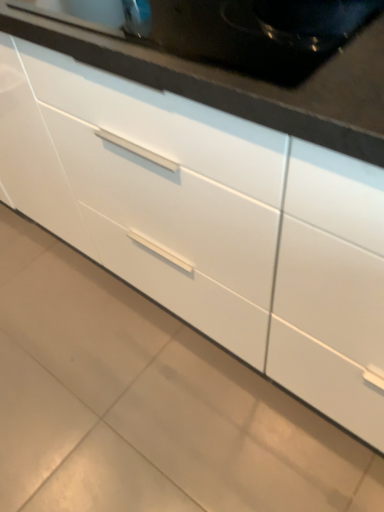
Measure the distance between black smooth countertop at upper center and camera.

A distance of 17.74 inches exists between black smooth countertop at upper center and camera.

The height and width of the screenshot is (512, 384). What do you see at coordinates (236, 57) in the screenshot?
I see `black smooth countertop at upper center` at bounding box center [236, 57].

In order to click on black smooth countertop at upper center in this screenshot , I will do `click(236, 57)`.

The height and width of the screenshot is (512, 384). I want to click on black smooth countertop at upper center, so click(x=236, y=57).